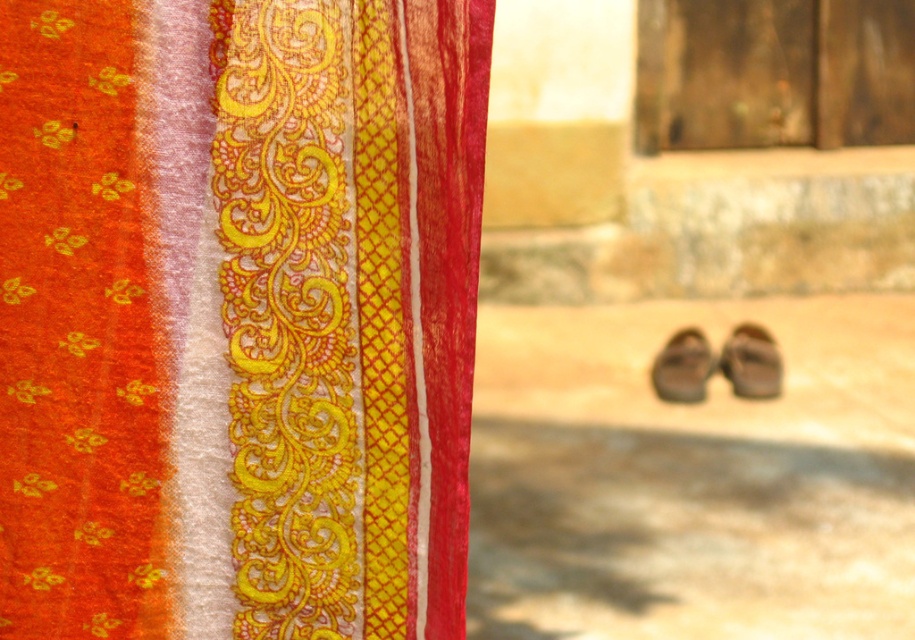
Where is `brown leather shoe at lower right`? This screenshot has height=640, width=915. brown leather shoe at lower right is located at coordinates (751, 362).

Can you confirm if brown leather shoe at lower right is wider than brown leather shoe at center?

No.

Does point (747, 339) come closer to viewer compared to point (673, 384)?

No, it is not.

Where is `brown leather shoe at lower right`? brown leather shoe at lower right is located at coordinates (751, 362).

Who is shorter, matte gold fabric at upper left or brown leather shoe at lower right?

Standing shorter between the two is brown leather shoe at lower right.

Does point (451, 493) come in front of point (733, 355)?

That is True.

What do you see at coordinates (237, 316) in the screenshot? The image size is (915, 640). I see `matte gold fabric at upper left` at bounding box center [237, 316].

Identify the location of matte gold fabric at upper left. This screenshot has width=915, height=640. (237, 316).

Can you confirm if matte gold fabric at upper left is positioned above brown leather shoe at center?

Yes.

Who is more distant from viewer, (131, 592) or (661, 385)?

Point (661, 385)

Locate an element on the screen. This screenshot has height=640, width=915. matte gold fabric at upper left is located at coordinates (237, 316).

Find the location of a particular element. This screenshot has height=640, width=915. matte gold fabric at upper left is located at coordinates (237, 316).